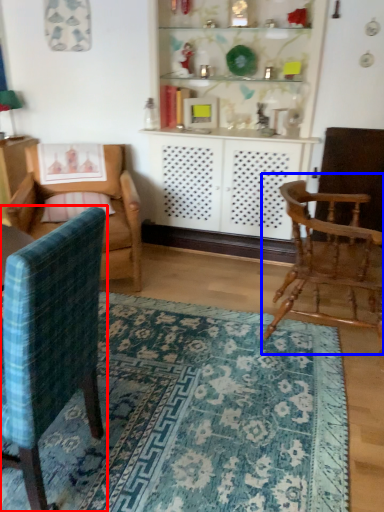
Question: Which object appears closest to the camera in this image, chair (highlighted by a red box) or chair (highlighted by a blue box)?

Choices:
 (A) chair
 (B) chair

Answer: (A)